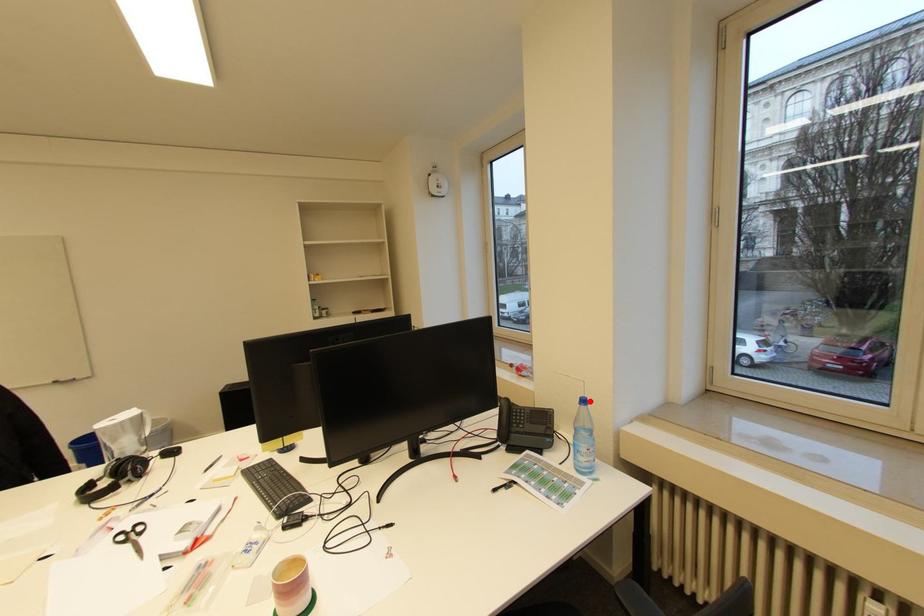
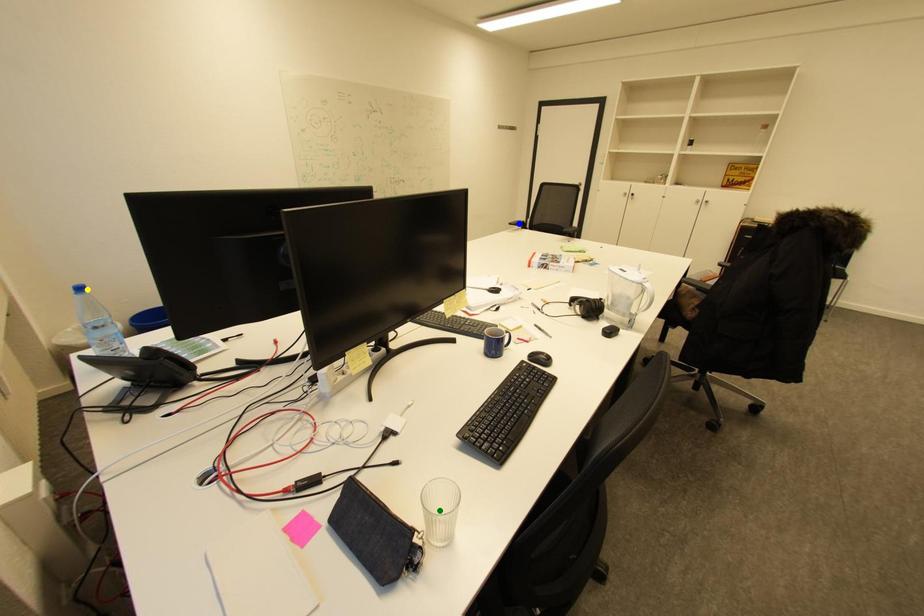
Question: I am providing you with two images of the same scene from different viewpoints. A red point is marked on the first image. You are given multiple points on the second image. Which point in image 2 is actually the same real-world point as the red point in image 1?

Choices:
 (A) green point
 (B) yellow point
 (C) blue point

Answer: (B)